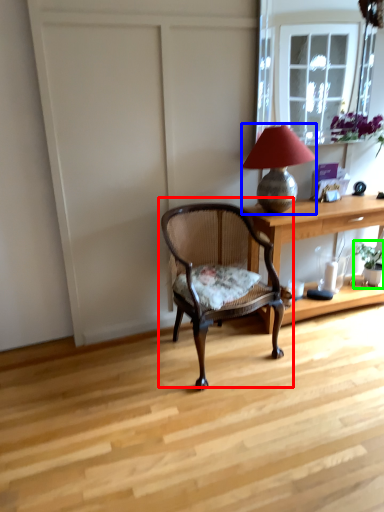
Question: Which is farther away from chair (highlighted by a red box)? lamp (highlighted by a blue box) or houseplant (highlighted by a green box)?

Choices:
 (A) lamp
 (B) houseplant

Answer: (B)